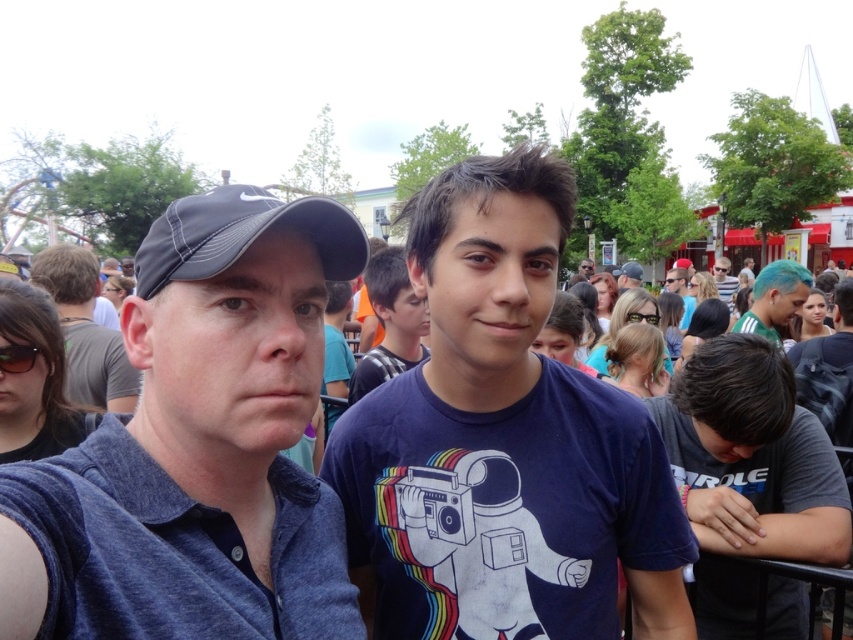
Can you confirm if dark blue t-shirt at center is thinner than teal hair at upper right?

Incorrect, dark blue t-shirt at center's width is not less than teal hair at upper right's.

Find the location of a particular element. dark blue t-shirt at center is located at coordinates (503, 442).

Is point (548, 288) positioned in front of point (296, 227)?

No, it is behind (296, 227).

Does dark blue t-shirt at center have a lesser width compared to dark blue fabric shirt at left?

No.

Between point (447, 312) and point (57, 624), which one is positioned behind?

The point (447, 312) is more distant.

Locate an element on the screen. The image size is (853, 640). dark blue t-shirt at center is located at coordinates (503, 442).

What do you see at coordinates (752, 456) in the screenshot?
I see `gray cotton t-shirt at lower right` at bounding box center [752, 456].

This screenshot has width=853, height=640. What do you see at coordinates (752, 456) in the screenshot?
I see `gray cotton t-shirt at lower right` at bounding box center [752, 456].

Where is `gray cotton t-shirt at lower right`? gray cotton t-shirt at lower right is located at coordinates (752, 456).